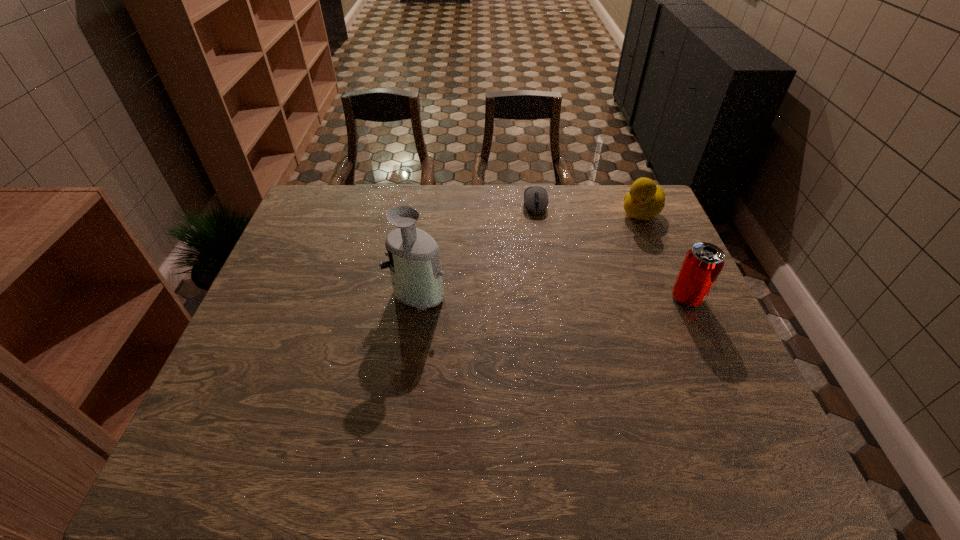
You are a GUI agent. You are given a task and a screenshot of the screen. Output one action in this format:
    pyautogui.click(x=<x>, y=<y>)
    Task: Click on the leftmost object
    
    Given the screenshot: What is the action you would take?
    pyautogui.click(x=414, y=261)

This screenshot has width=960, height=540. Identify the location of juicer. (414, 261).

This screenshot has width=960, height=540. I want to click on soda can, so click(703, 263).

Where is `duck`? The height and width of the screenshot is (540, 960). duck is located at coordinates (645, 200).

The height and width of the screenshot is (540, 960). Identify the location of computer equipment. (535, 198).

Locate an element on the screen. The width and height of the screenshot is (960, 540). the third object from right to left is located at coordinates (535, 198).

At what (x,y) coordinates should I click in order to perform the action: click on free location located on the back of the leftmost object. Please return your answer as a coordinate pair (x, y). This screenshot has width=960, height=540. Looking at the image, I should click on (429, 198).

The height and width of the screenshot is (540, 960). I want to click on blank area located on the left of the second tallest object, so click(604, 298).

Image resolution: width=960 pixels, height=540 pixels. Find the location of `free spot located on the front-facing side of the duck`. free spot located on the front-facing side of the duck is located at coordinates (559, 276).

In order to click on vacant space located 0.220m on the front-facing side of the duck in this screenshot , I will do `click(588, 253)`.